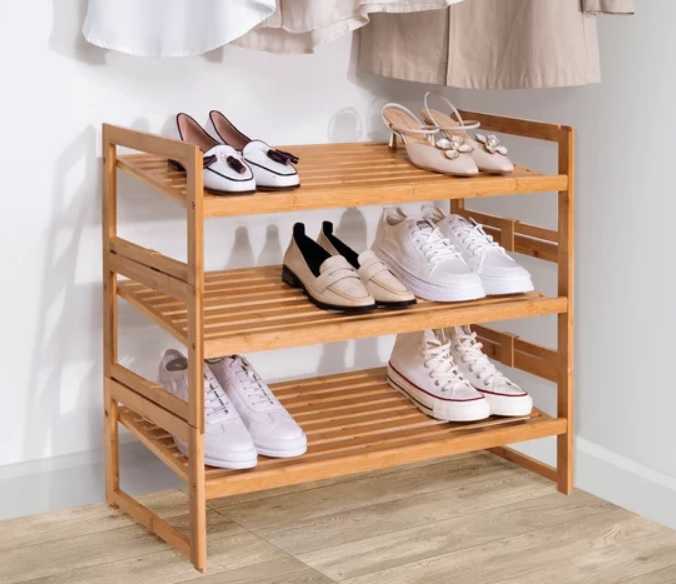
Locate an element on the screen. The width and height of the screenshot is (676, 584). pairs of shoes is located at coordinates (233, 404), (341, 280), (452, 257), (466, 383), (450, 149), (222, 150).